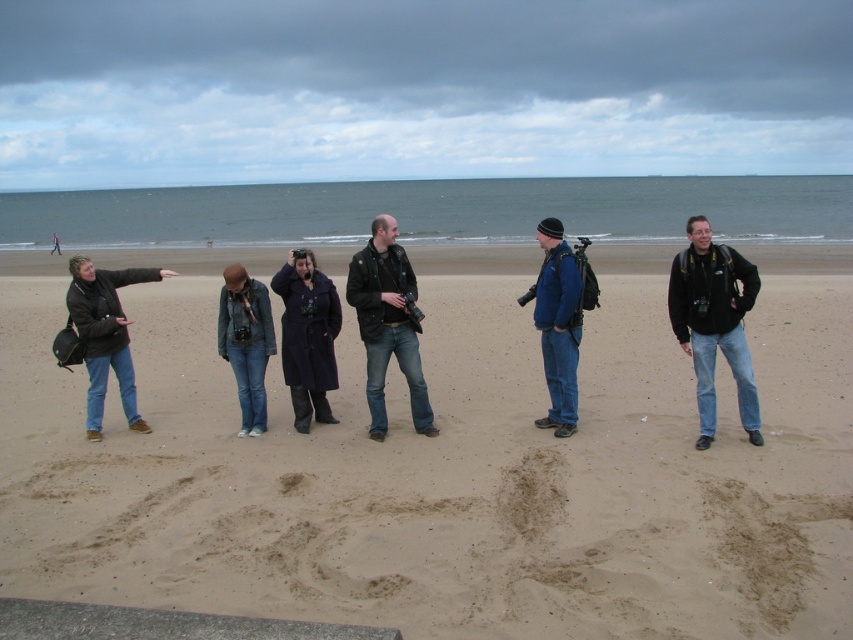
Between point (671, 436) and point (384, 355), which one is positioned behind?

Point (671, 436)

The image size is (853, 640). I want to click on brown sand at center, so pos(444,474).

Can you confirm if matte black jacket at center is smaller than denim jacket at center?

Indeed, matte black jacket at center has a smaller size compared to denim jacket at center.

Between point (383, 346) and point (248, 323), which one is positioned behind?

Point (248, 323)

Who is more distant from viewer, (378,296) or (245,333)?

Positioned behind is point (245,333).

Identify the location of matte black jacket at center. The image size is (853, 640). [387, 323].

Can you confirm if black matte jacket at center is positioned below purple wool coat at center?

No.

Between black matte jacket at center and purple wool coat at center, which one appears on the right side from the viewer's perspective?

Positioned to the right is black matte jacket at center.

Is point (711, 292) farther from viewer compared to point (291, 342)?

No, it is in front of (291, 342).

This screenshot has width=853, height=640. In order to click on black matte jacket at center in this screenshot , I will do `click(714, 323)`.